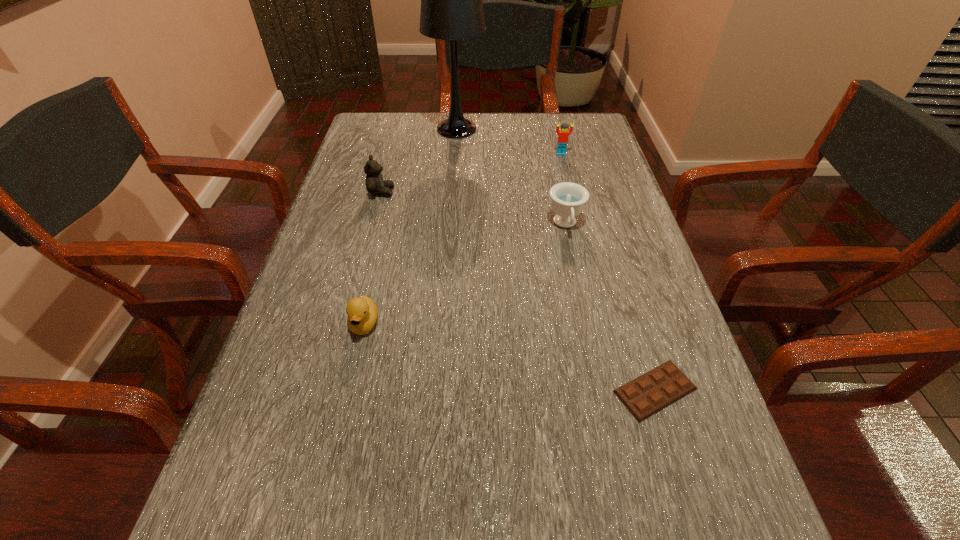
At what (x,y) coordinates should I click in order to perform the action: click on chocolate bar at the right edge. Please return your answer as a coordinate pair (x, y). Looking at the image, I should click on (648, 394).

The image size is (960, 540). What are the coordinates of `object located at the far right corner` in the screenshot? It's located at (563, 134).

Locate an element on the screen. vacant point at the far edge is located at coordinates (449, 144).

Identify the location of vacant space at the left edge of the desktop. The width and height of the screenshot is (960, 540). (337, 271).

This screenshot has width=960, height=540. In order to click on blank space at the right edge of the desktop in this screenshot , I will do `click(627, 206)`.

The width and height of the screenshot is (960, 540). Find the location of `vacant area at the far right corner`. vacant area at the far right corner is located at coordinates (549, 129).

Locate an element on the screen. This screenshot has height=540, width=960. free spot between the teddy bear and the second farthest object is located at coordinates (471, 173).

You are a GUI agent. You are given a task and a screenshot of the screen. Output one action in this format:
    pyautogui.click(x=<x>, y=<y>)
    Task: Click on the free space between the second nearest object and the fifth nearest object
    This screenshot has height=540, width=960.
    Given the screenshot: What is the action you would take?
    [x=463, y=239]

You are a GUI agent. You are given a task and a screenshot of the screen. Output one action in this format:
    pyautogui.click(x=<x>, y=<y>)
    Task: Click on the free space between the tallest object and the second nearest object
    
    Given the screenshot: What is the action you would take?
    pyautogui.click(x=411, y=226)

This screenshot has width=960, height=540. I want to click on vacant space in between the third farthest object and the third nearest object, so click(x=473, y=208).